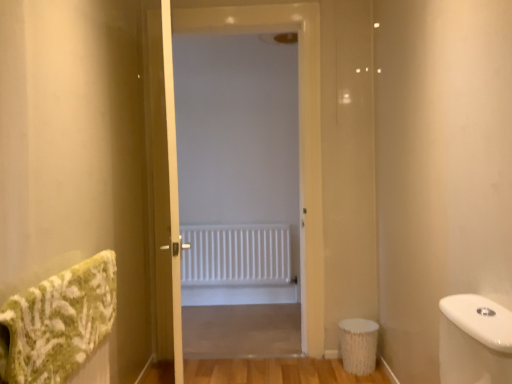
Question: In terms of height, does white textured toilet bowl at lower right look taller or shorter compared to white matte radiator at center?

Choices:
 (A) tall
 (B) short

Answer: (B)

Question: Considering the positions of point (362, 357) and point (217, 243), is point (362, 357) closer or farther from the camera than point (217, 243)?

Choices:
 (A) farther
 (B) closer

Answer: (B)

Question: Estimate the real-world distances between objects in this image. Which object is closer to the wooden screen door at center?

Choices:
 (A) white textured toilet bowl at lower right
 (B) white matte radiator at center
 (C) green textured bath towel at left
 (D) white matte radiator at center

Answer: (D)

Question: Considering the real-world distances, which object is farthest from the wooden screen door at center?

Choices:
 (A) white matte radiator at center
 (B) white textured toilet bowl at lower right
 (C) green textured bath towel at left
 (D) white matte radiator at center

Answer: (D)